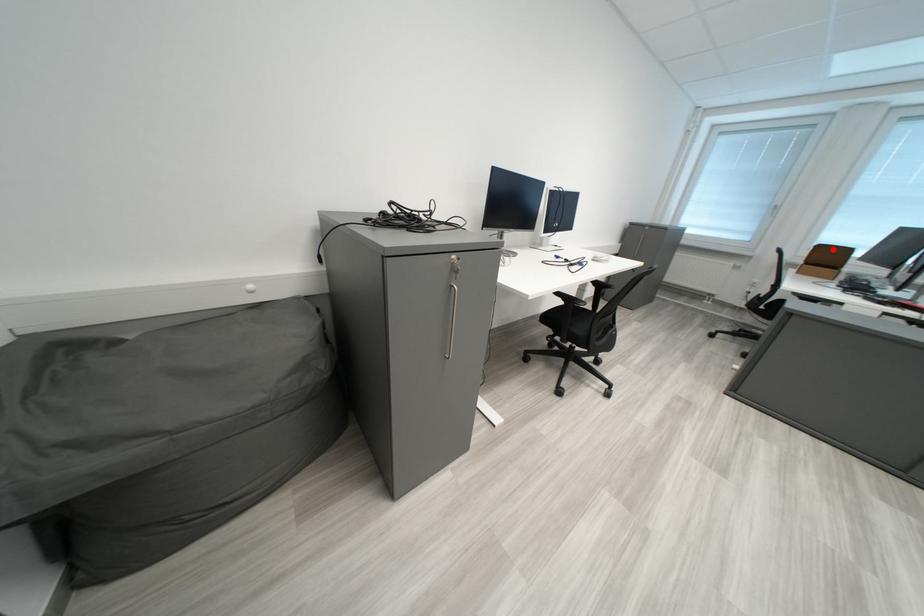
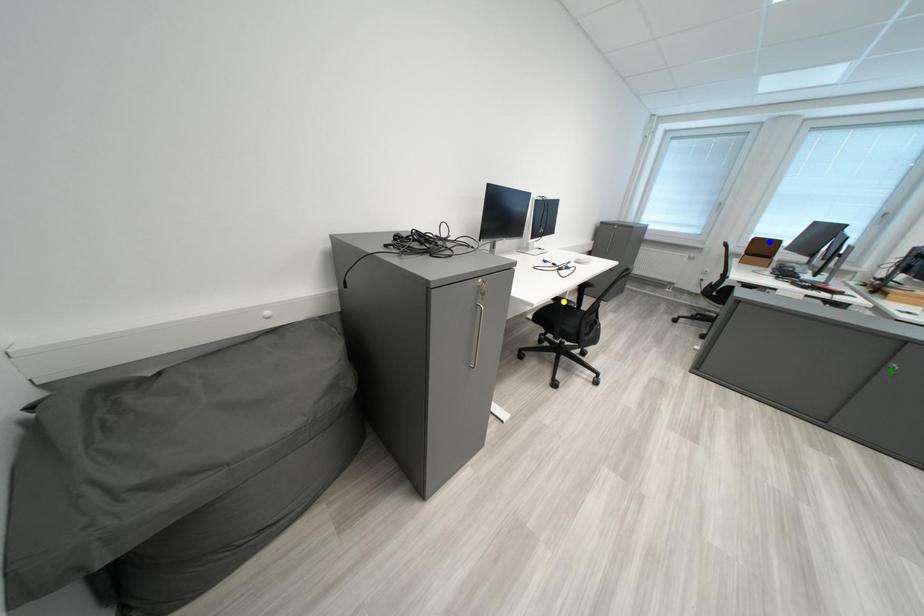
Question: I am providing you with two images of the same scene from different viewpoints. A red point is marked on the first image. You are given multiple points on the second image. Which mark in image 2 goes with the point in image 1?

Choices:
 (A) green point
 (B) yellow point
 (C) blue point

Answer: (C)